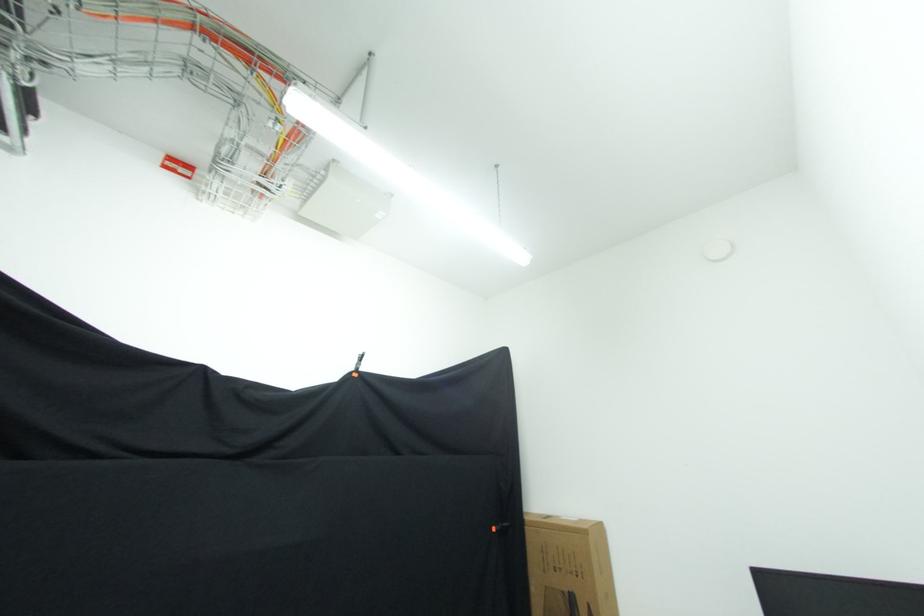
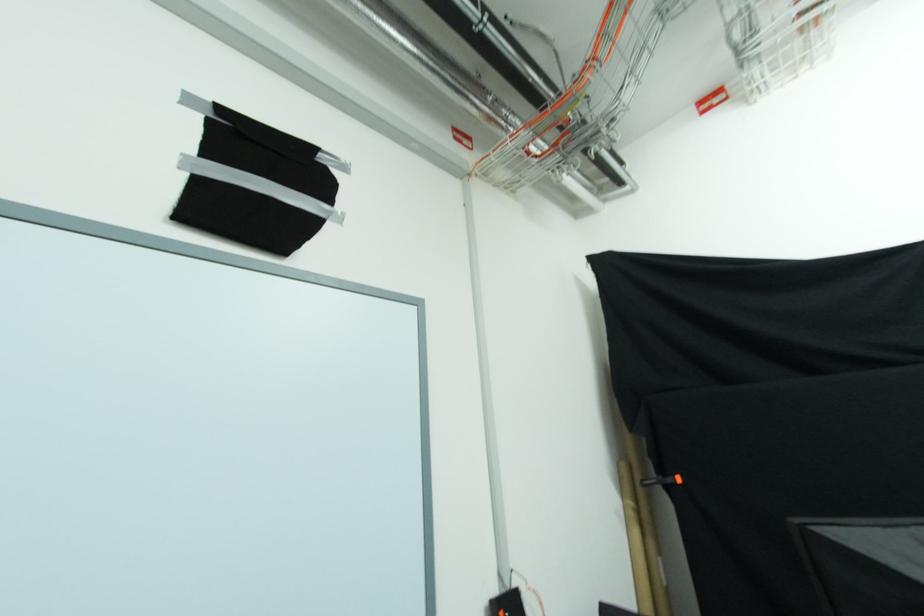
How did the camera likely rotate?

The camera rotated toward left-up.